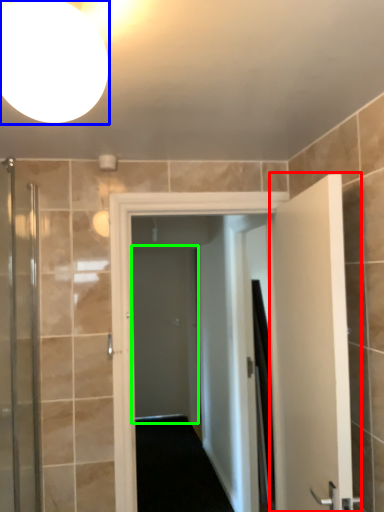
Question: Based on their relative distances, which object is nearer to door (highlighted by a red box)? Choose from light fixture (highlighted by a blue box) and screen door (highlighted by a green box).

Choices:
 (A) light fixture
 (B) screen door

Answer: (A)